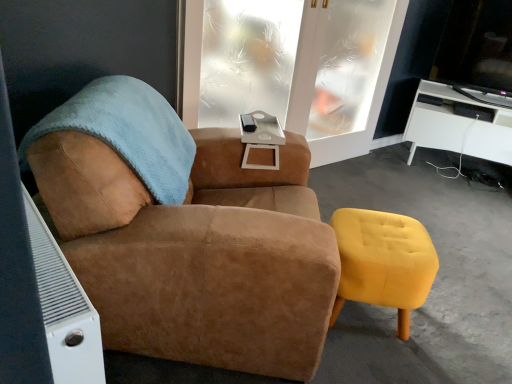
Locate an element on the screen. free spot to the right of yellow velvet stool at lower right is located at coordinates (449, 333).